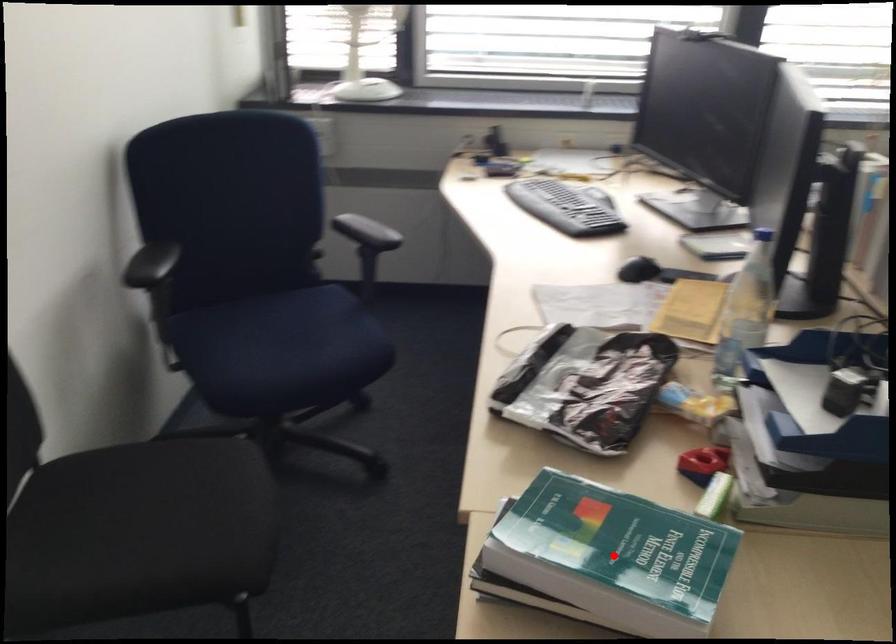
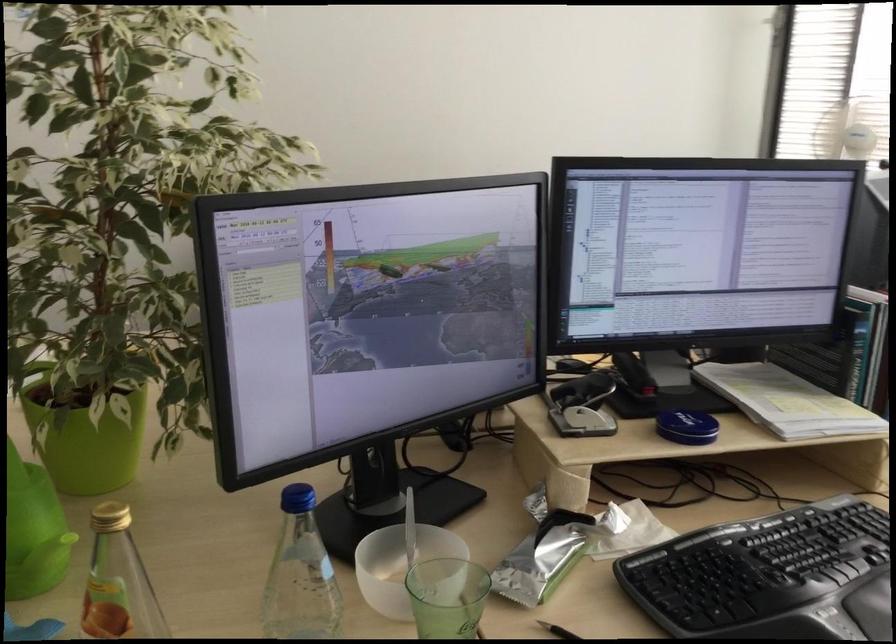
Question: I am providing you with two images of the same scene from different viewpoints. A red point is marked on the first image. Can you still see the location of the red point in image 2?

Choices:
 (A) Yes
 (B) No

Answer: (B)